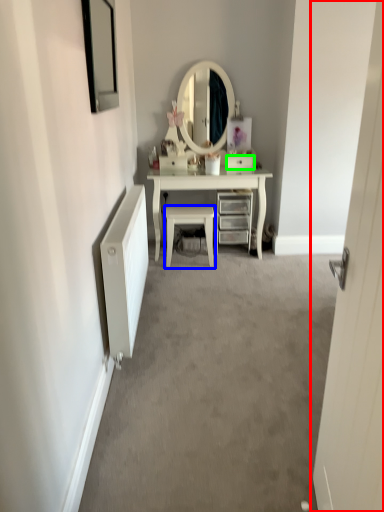
Question: Which is nearer to the door (highlighted by a red box)? chair (highlighted by a blue box) or drawer (highlighted by a green box).

Choices:
 (A) chair
 (B) drawer

Answer: (A)